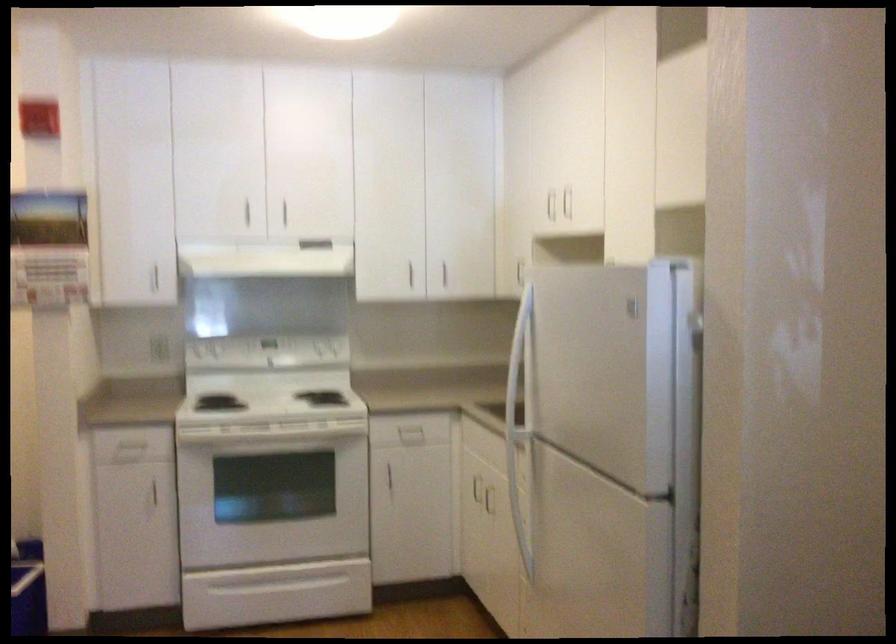
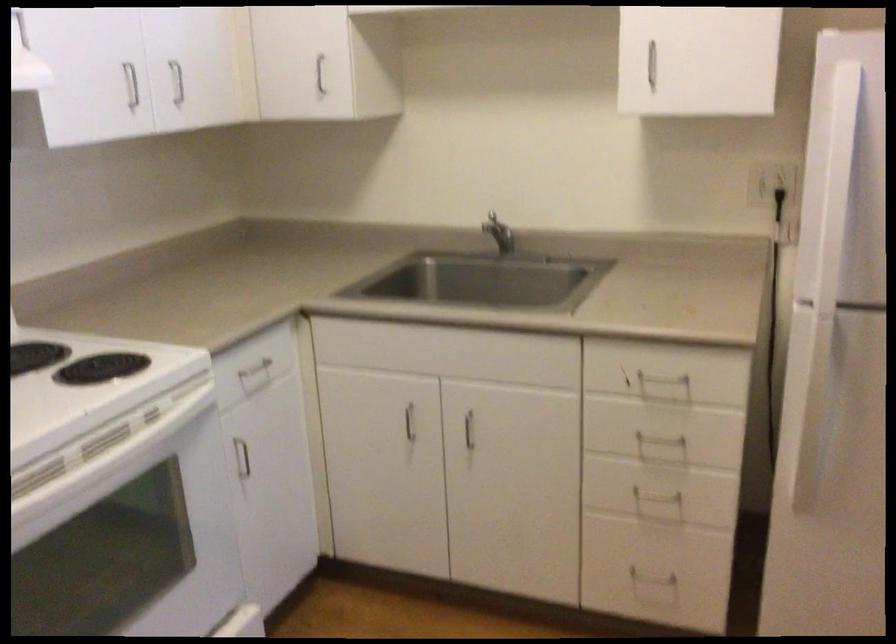
Find the pixel in the second image that matches point (390, 474) in the first image.

(242, 458)